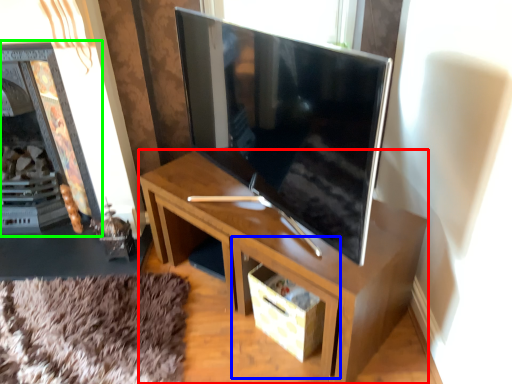
Question: Which object is positioned farthest from desk (highlighted by a red box)? Select from drawer (highlighted by a blue box) and fireplace (highlighted by a green box).

Choices:
 (A) drawer
 (B) fireplace

Answer: (B)